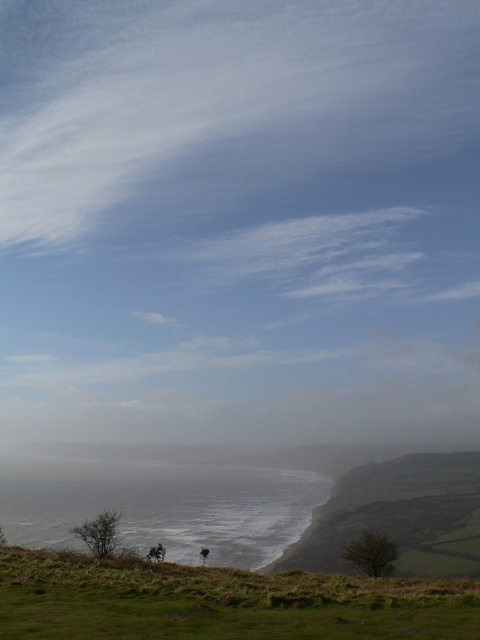
Who is positioned more to the left, green grassy at lower center or green grassy hillside at lower right?

Positioned to the left is green grassy at lower center.

Does green grassy at lower center have a lesser height compared to green grassy hillside at lower right?

Yes.

Between point (419, 609) and point (459, 566), which one is positioned behind?

The point (459, 566) is more distant.

The width and height of the screenshot is (480, 640). In order to click on green grassy at lower center in this screenshot , I will do [218, 600].

Who is more distant from viewer, (123, 589) or (69, 502)?

The point (69, 502) is behind.

Between green grassy at lower center and gray matte water at center, which one has more height?

gray matte water at center

Between point (181, 620) and point (13, 488), which one is positioned behind?

The point (13, 488) is more distant.

Where is `green grassy at lower center`? The width and height of the screenshot is (480, 640). green grassy at lower center is located at coordinates (218, 600).

Consider the image. Between white cotton cloud at upper center and green grassy at lower center, which one appears on the left side from the viewer's perspective?

From the viewer's perspective, green grassy at lower center appears more on the left side.

Does white cotton cloud at upper center have a larger size compared to green grassy at lower center?

Indeed, white cotton cloud at upper center has a larger size compared to green grassy at lower center.

Find the location of `white cotton cloud at upper center`. white cotton cloud at upper center is located at coordinates (218, 97).